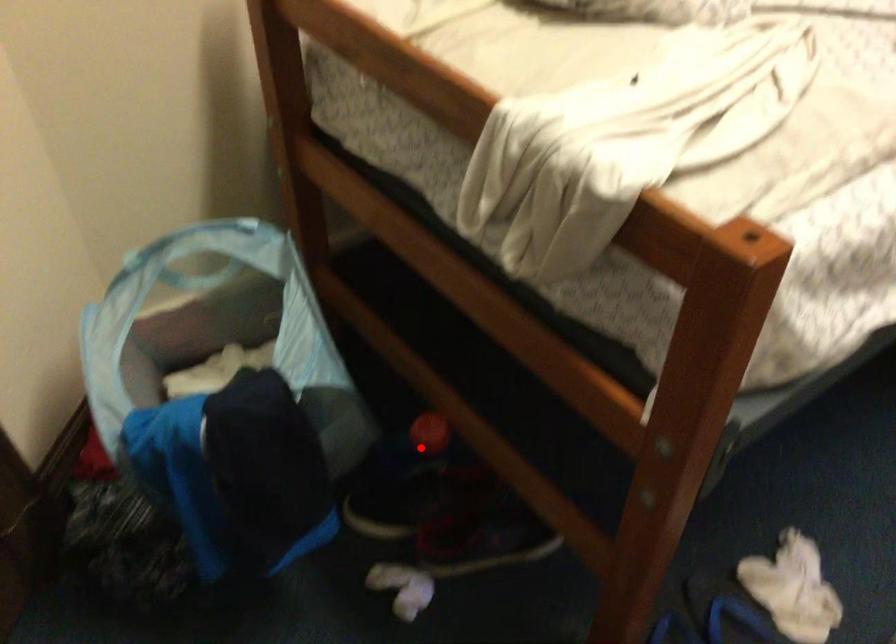
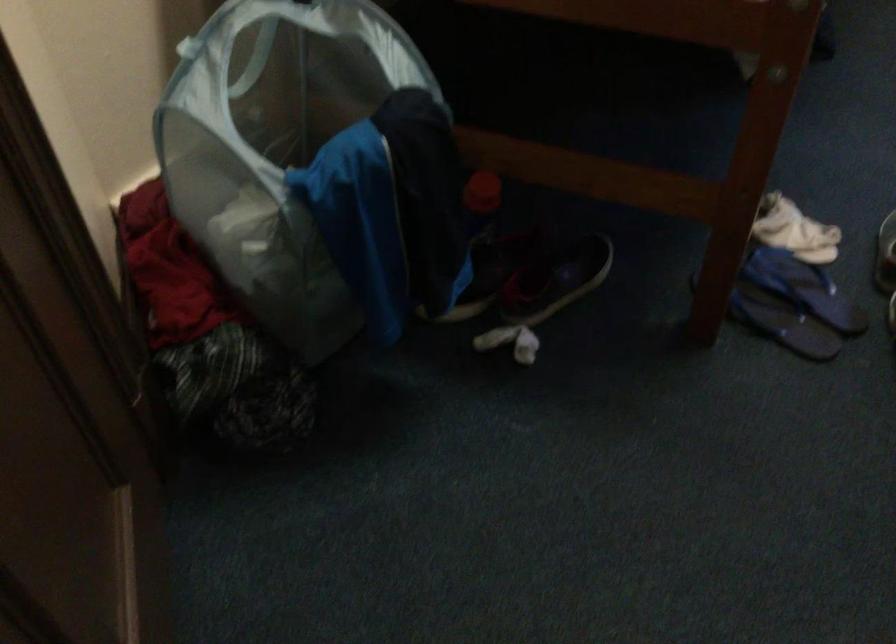
Where in the second image is the point corresponding to the highlighted location from the first image?

(480, 202)